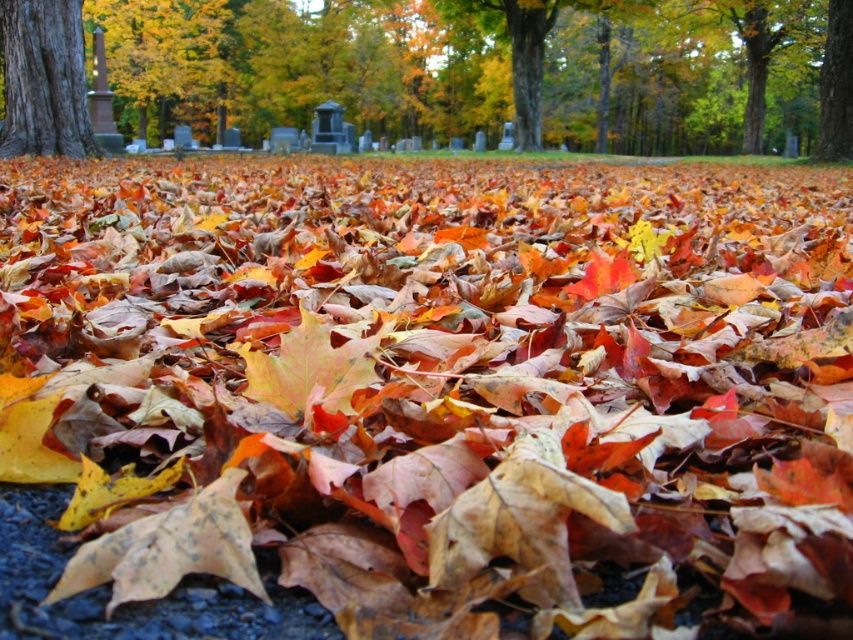
Question: Among these objects, which one is nearest to the camera?

Choices:
 (A) smooth brown tree trunk at upper left
 (B) multicolored paper-like maple leaf at center

Answer: (B)

Question: Among these objects, which one is farthest from the camera?

Choices:
 (A) smooth gray tombstone at center
 (B) smooth brown tree trunk at upper left
 (C) multicolored paper-like maple leaf at center

Answer: (A)

Question: Is smooth gray tombstone at center thinner than multicolored paper-like maple leaf at center?

Choices:
 (A) no
 (B) yes

Answer: (A)

Question: Does smooth gray tombstone at center have a lesser width compared to yellowish-brown textured leaf at center?

Choices:
 (A) no
 (B) yes

Answer: (A)

Question: Is smooth gray tombstone at center bigger than multicolored paper-like maple leaf at center?

Choices:
 (A) no
 (B) yes

Answer: (B)

Question: Which object is the farthest from the smooth brown tree trunk at upper left?

Choices:
 (A) smooth gray tombstone at center
 (B) multicolored paper-like maple leaf at center
 (C) yellowish-brown textured leaf at center

Answer: (A)